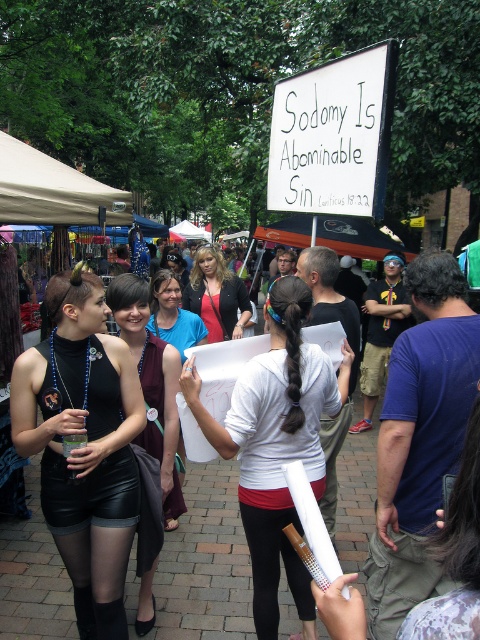
Can you confirm if leather skirt at left is thinner than matte black jacket at center?

Yes, leather skirt at left is thinner than matte black jacket at center.

Who is more distant from viewer, (186, 509) or (212, 266)?

The point (212, 266) is behind.

You are a GUI agent. You are given a task and a screenshot of the screen. Output one action in this format:
    pyautogui.click(x=<x>, y=<y>)
    Task: Click on the leather skirt at left
    This screenshot has width=480, height=640.
    Given the screenshot: What is the action you would take?
    pyautogui.click(x=152, y=385)

Describe the element at coordinates (202, 564) in the screenshot. I see `matte black shorts at lower left` at that location.

At what (x,y) coordinates should I click in order to perform the action: click on matte black shorts at lower left. Please return your answer as a coordinate pair (x, y). The image size is (480, 640). Looking at the image, I should click on (202, 564).

Is point (312, 433) closer to camera compared to point (145, 372)?

Yes, it is.

Between white matte paper at center and leather skirt at left, which one appears on the right side from the viewer's perspective?

white matte paper at center is more to the right.

You are a GUI agent. You are given a task and a screenshot of the screen. Output one action in this format:
    pyautogui.click(x=<x>, y=<y>)
    Task: Click on the white matte paper at center
    Image resolution: width=480 pixels, height=640 pixels.
    Given the screenshot: What is the action you would take?
    pyautogui.click(x=276, y=444)

This screenshot has width=480, height=640. In order to click on white matte paper at center in this screenshot , I will do `click(276, 444)`.